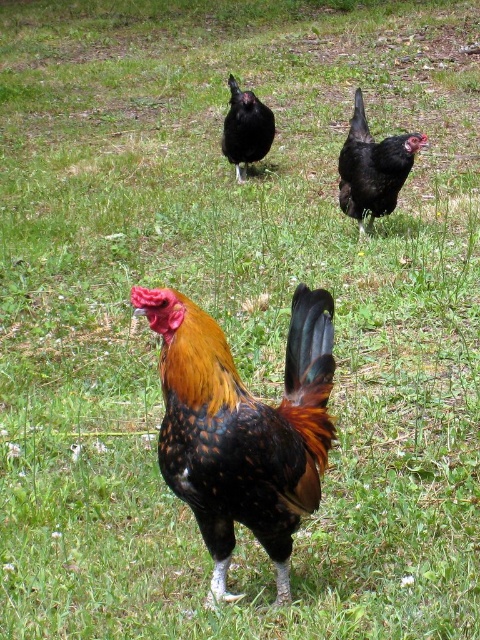
You are a farmer checking the health of your chickens. You notice the multicolored feathered rooster at center and the black glossy chicken at center. Which chicken has a slimmer body shape?

The multicolored feathered rooster at center is thinner than the black glossy chicken at center, so the multicolored feathered rooster at center has a slimmer body shape.

Based on the coordinates provided, where is the multicolored feathered rooster at center located in the image?

The multicolored feathered rooster at center is located at the coordinates point (241, 428).